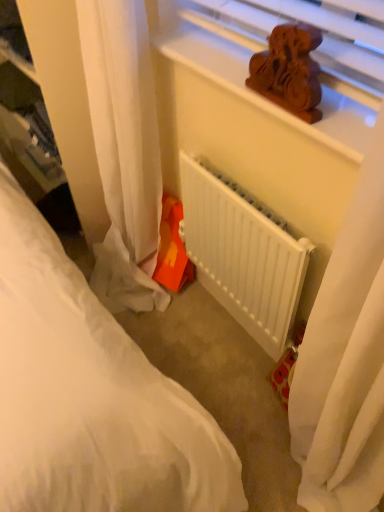
The width and height of the screenshot is (384, 512). Find the location of `vacant space to the right of brown wooden statue at upper center`. vacant space to the right of brown wooden statue at upper center is located at coordinates (342, 110).